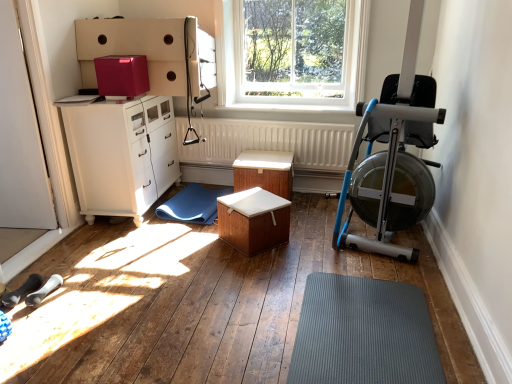
Find the location of `free space between wooden box at center, acting as the 1th table starting from the front, and gray rubber mat at lower center, arranged as the second doormat when viewed from the top`. free space between wooden box at center, acting as the 1th table starting from the front, and gray rubber mat at lower center, arranged as the second doormat when viewed from the top is located at coordinates (284, 283).